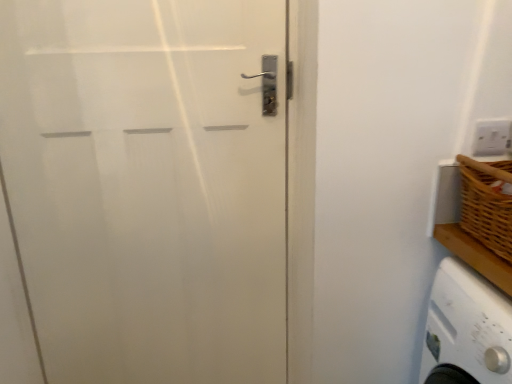
Question: From the image's perspective, does white plastic electric outlet at upper right appear higher than white matte door at left?

Choices:
 (A) no
 (B) yes

Answer: (B)

Question: From a real-world perspective, is white plastic electric outlet at upper right on top of white matte door at left?

Choices:
 (A) yes
 (B) no

Answer: (A)

Question: Can you confirm if white plastic electric outlet at upper right is taller than white matte door at left?

Choices:
 (A) yes
 (B) no

Answer: (B)

Question: From the image's perspective, is white plastic electric outlet at upper right located beneath white matte door at left?

Choices:
 (A) no
 (B) yes

Answer: (A)

Question: Can you confirm if white plastic electric outlet at upper right is positioned to the left of white matte door at left?

Choices:
 (A) yes
 (B) no

Answer: (B)

Question: Is white matte door at left at the back of white plastic electric outlet at upper right?

Choices:
 (A) yes
 (B) no

Answer: (B)

Question: Considering the relative sizes of white matte door at left and white plastic electric outlet at upper right in the image provided, is white matte door at left taller than white plastic electric outlet at upper right?

Choices:
 (A) no
 (B) yes

Answer: (B)

Question: Is white matte door at left smaller than white plastic electric outlet at upper right?

Choices:
 (A) yes
 (B) no

Answer: (B)

Question: Is white matte door at left positioned behind white plastic electric outlet at upper right?

Choices:
 (A) yes
 (B) no

Answer: (B)

Question: Is white matte door at left shorter than white plastic electric outlet at upper right?

Choices:
 (A) no
 (B) yes

Answer: (A)

Question: From the image's perspective, is white matte door at left on white plastic electric outlet at upper right?

Choices:
 (A) no
 (B) yes

Answer: (A)

Question: Is white matte door at left closer to camera compared to white plastic electric outlet at upper right?

Choices:
 (A) yes
 (B) no

Answer: (A)

Question: From their relative heights in the image, would you say white matte door at left is taller or shorter than white plastic electric outlet at upper right?

Choices:
 (A) short
 (B) tall

Answer: (B)